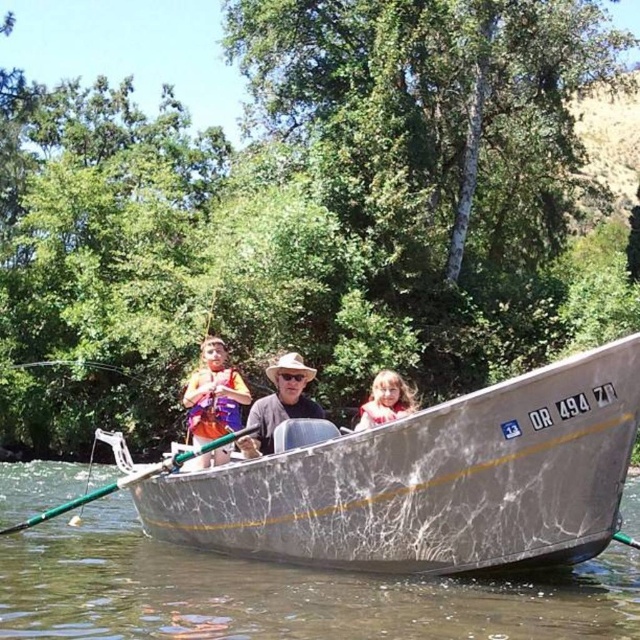
You are a drone operator trying to capture a photo of the matte gray hat at center from above. The drone has a camera with a 100mm lens. Given that the hat is at coordinates point 0.631, 0.438, what is the best way to position the drone to ensure the hat is centered in the photo?

The matte gray hat at center is located at point [280,403]. To center it in the photo, position the drone directly above the hat at those coordinates using the camera lens.

You are standing on the dock and want to retrieve the green metallic paddle at center from the silver metallic boat at center. Which object should you approach first?

You should approach the silver metallic boat at center first because it is closer to you than the green metallic paddle at center, so you can reach the paddle by accessing the boat first.